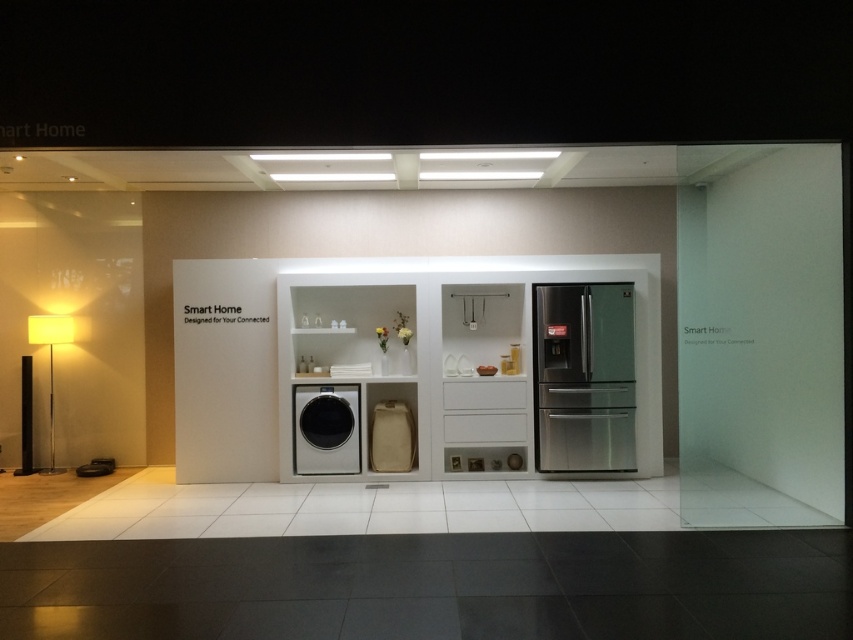
You are a delivery person who needs to place a new package between the stainless steel refrigerator at center and the matte white floor lamp at left. The package is 16 feet long. Can you fit it between them?

The distance between the stainless steel refrigerator at center and the matte white floor lamp at left is 17.67 feet, so yes, the 16 feet long package can fit between them as there is enough space.

Based on the photo, you are setting up a new smart home and need to place a new device between the sleek metallic washing machine at center and the matte white floor lamp at left. Based on their positions, which side of the floor lamp should you place the device to ensure it is closer to the washing machine?

The sleek metallic washing machine at center is to the right of the matte white floor lamp at left, so placing the device to the right side of the matte white floor lamp at left would position it closer to the washing machine.

You are an interior designer planning to move the stainless steel refrigerator at center closer to the entrance. However, you must ensure it doesn not block the matte white floor lamp at left. Based on their current positions, is this possible?

The stainless steel refrigerator at center is currently in front of the matte white floor lamp at left. Moving it closer to the entrance would require shifting it sideways or adjusting its angle so it doesn block the lamp, which is feasible as long as there is enough space around them.